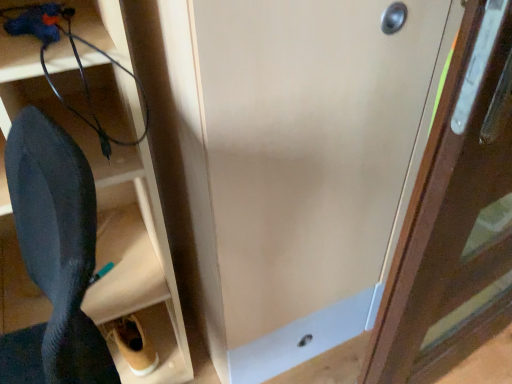
Question: In terms of height, does wooden door at right, the 2th door when ordered from left to right, look taller or shorter compared to matte wood door at center, the second door viewed from the right?

Choices:
 (A) short
 (B) tall

Answer: (B)

Question: Considering their positions, is wooden door at right, which ranks as the 1th door in right-to-left order, located in front of or behind matte wood door at center, which ranks as the first door in left-to-right order?

Choices:
 (A) front
 (B) behind

Answer: (A)

Question: Which object is the closest to the wooden door at right, which ranks as the 1th door in right-to-left order?

Choices:
 (A) black rubber wire at lower left
 (B) black matte shoe at lower left
 (C) matte wood door at center, which ranks as the first door in left-to-right order

Answer: (C)

Question: Estimate the real-world distances between objects in this image. Which object is closer to the wooden door at right, which ranks as the 1th door in right-to-left order?

Choices:
 (A) matte wood door at center, which ranks as the first door in left-to-right order
 (B) black matte shoe at lower left
 (C) black rubber wire at lower left

Answer: (A)